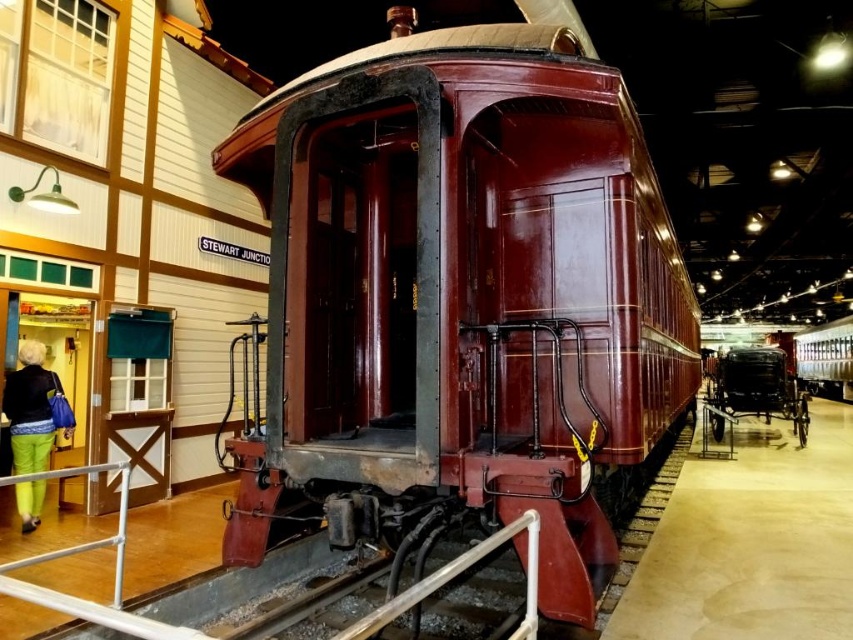
Does green fabric pants at lower left have a smaller size compared to white metal rail at lower left?

Incorrect, green fabric pants at lower left is not smaller in size than white metal rail at lower left.

Which of these two, green fabric pants at lower left or white metal rail at lower left, stands taller?

Standing taller between the two is green fabric pants at lower left.

Which is behind, point (28, 419) or point (24, 580)?

The point (28, 419) is more distant.

Where is `green fabric pants at lower left`? The width and height of the screenshot is (853, 640). green fabric pants at lower left is located at coordinates (32, 410).

Is the position of shiny black carriage at center less distant than that of shiny silver train at right?

Yes, it is.

Does shiny black carriage at center have a lesser height compared to shiny silver train at right?

Yes.

Where is `shiny black carriage at center`? Image resolution: width=853 pixels, height=640 pixels. shiny black carriage at center is located at coordinates (753, 390).

Image resolution: width=853 pixels, height=640 pixels. I want to click on shiny black carriage at center, so click(x=753, y=390).

Can you confirm if green fabric pants at lower left is wider than shiny black carriage at center?

In fact, green fabric pants at lower left might be narrower than shiny black carriage at center.

Is point (27, 444) farther from camera compared to point (711, 410)?

That is False.

Who is more distant from viewer, (27, 513) or (791, 410)?

Positioned behind is point (791, 410).

Find the location of a particular element. The width and height of the screenshot is (853, 640). green fabric pants at lower left is located at coordinates (x=32, y=410).